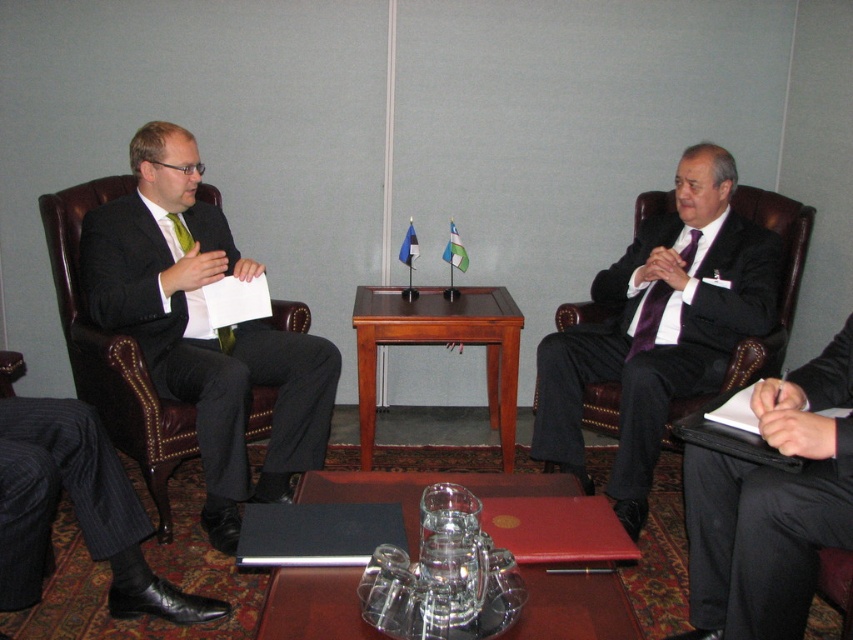
Question: Can you confirm if purple satin suit at center is thinner than black smooth suit at right?

Choices:
 (A) yes
 (B) no

Answer: (B)

Question: Which object appears closest to the camera in this image?

Choices:
 (A) transparent glass table at center
 (B) pinstripe fabric suit at lower left
 (C) purple satin suit at center

Answer: (A)

Question: Which of the following is the closest to the observer?

Choices:
 (A) transparent glass table at center
 (B) pinstripe fabric suit at lower left
 (C) black smooth suit at right
 (D) brown leather armchair at left

Answer: (A)

Question: Which point is closer to the camera?

Choices:
 (A) brown leather armchair at left
 (B) pinstripe fabric suit at lower left
 (C) purple satin tie at center
 (D) brown wooden table at center

Answer: (B)

Question: Can you confirm if brown wooden table at center is wider than purple satin tie at center?

Choices:
 (A) no
 (B) yes

Answer: (B)

Question: Can you confirm if purple satin suit at center is smaller than black smooth suit at right?

Choices:
 (A) yes
 (B) no

Answer: (B)